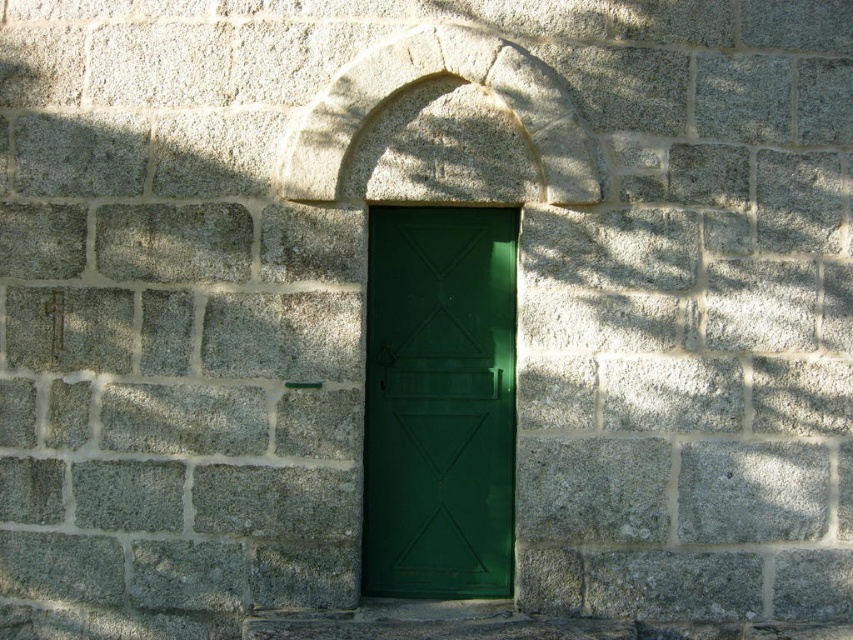
Question: Where is green matte door at center located in relation to gray stone arch at center in the image?

Choices:
 (A) right
 (B) left

Answer: (A)

Question: Which of the following is the closest to the observer?

Choices:
 (A) (413, 74)
 (B) (422, 320)

Answer: (A)

Question: Which of the following is the closest to the observer?

Choices:
 (A) (489, 467)
 (B) (317, 145)

Answer: (B)

Question: Can you confirm if green matte door at center is positioned above gray stone arch at center?

Choices:
 (A) no
 (B) yes

Answer: (A)

Question: Considering the relative positions of green matte door at center and gray stone arch at center in the image provided, where is green matte door at center located with respect to gray stone arch at center?

Choices:
 (A) left
 (B) right

Answer: (B)